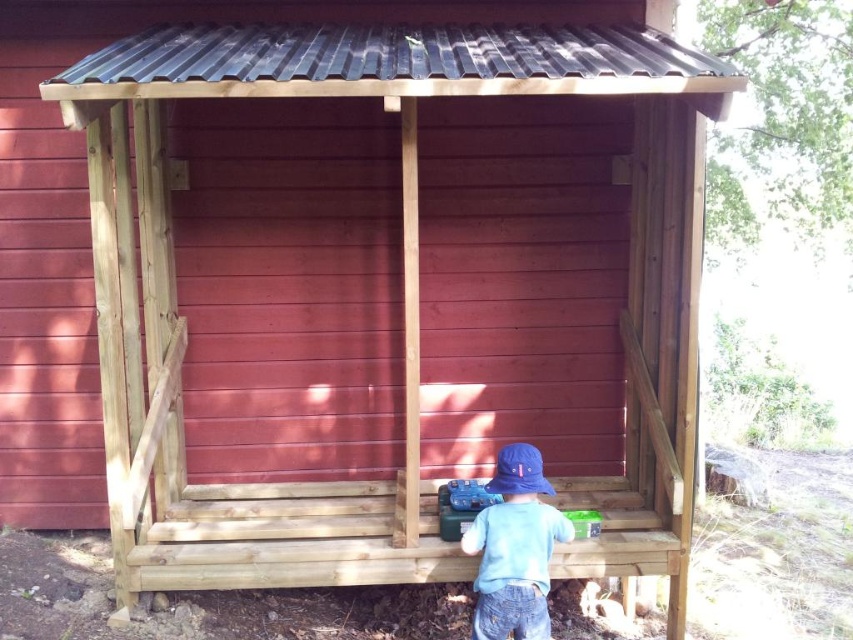
You are standing in front of the wooden shed with a corrugated metal roof. You notice a point at coordinates (514, 548). What object is located at that point?

The point at coordinates (514, 548) is on the light blue cotton shirt at center.

You are standing in front of the wooden shed with a corrugated metal roof. You see a light blue cotton shirt at center and a blue fabric baseball hat at lower center. Which object is closer to you?

The light blue cotton shirt at center is closer to you because it is in front of the blue fabric baseball hat at lower center.

You are standing in front of the wooden shed with a slanted roof. You notice a light blue cotton shirt at center and a blue fabric baseball hat at lower center. Which object is positioned higher up in the scene?

The light blue cotton shirt at center is much taller than the blue fabric baseball hat at lower center, so the light blue cotton shirt at center is positioned higher up in the scene.